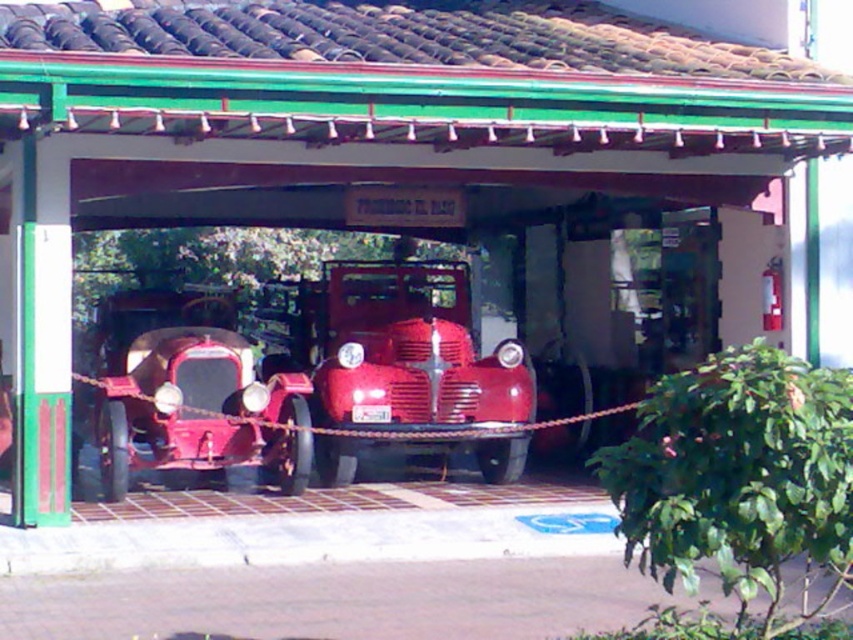
You are a museum guide who needs to arrange a new exhibit. You have a new sculpture that is 2 meters wide. You want to place it between the glossy red truck at center and the shiny red car at center. Based on their widths, can the sculpture fit between them without overlapping either vehicle?

The glossy red truck at center is wider than the shiny red car at center. However, the exact widths are not provided. Therefore, it is uncertain if the 2 meter wide sculpture can fit between them without overlapping. More information about their specific widths is needed to determine this.

You are standing at the entrance of the vintage car display and want to take a photo of both the glossy red truck at center and the shiny red car at center. Which object should you position to your left to include both in the frame?

You should position the shiny red car at center to your left since the glossy red truck at center is to the right of it, ensuring both are included in the frame.